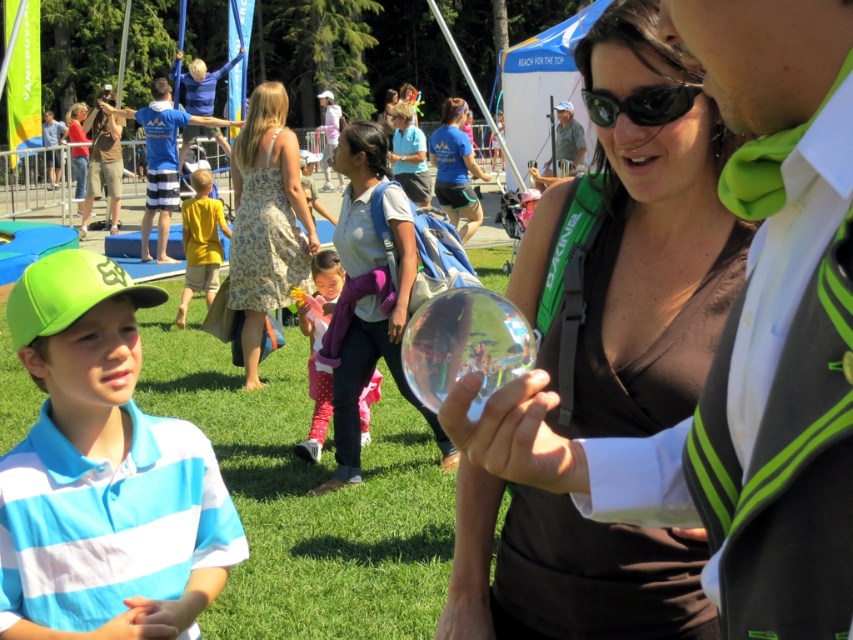
Question: Which of the following is the farthest from the observer?

Choices:
 (A) 250,97
 (B) 363,376
 (C) 328,403
 (D) 743,166

Answer: (A)

Question: Which point is farther to the camera?

Choices:
 (A) (746, 516)
 (B) (469, 232)
 (C) (335, 412)

Answer: (B)

Question: Which of the following is the closest to the observer?

Choices:
 (A) (57, 609)
 (B) (647, 116)

Answer: (B)

Question: From the image, what is the correct spatial relationship of green satin bow tie at center in relation to yellow cotton shirt at center?

Choices:
 (A) above
 (B) below

Answer: (B)

Question: Is matte gray shirt at center positioned at the back of blue t-shirt at center?

Choices:
 (A) no
 (B) yes

Answer: (A)

Question: In this image, where is transparent glass sphere at center located relative to blue striped polo shirt at lower left?

Choices:
 (A) right
 (B) left

Answer: (A)